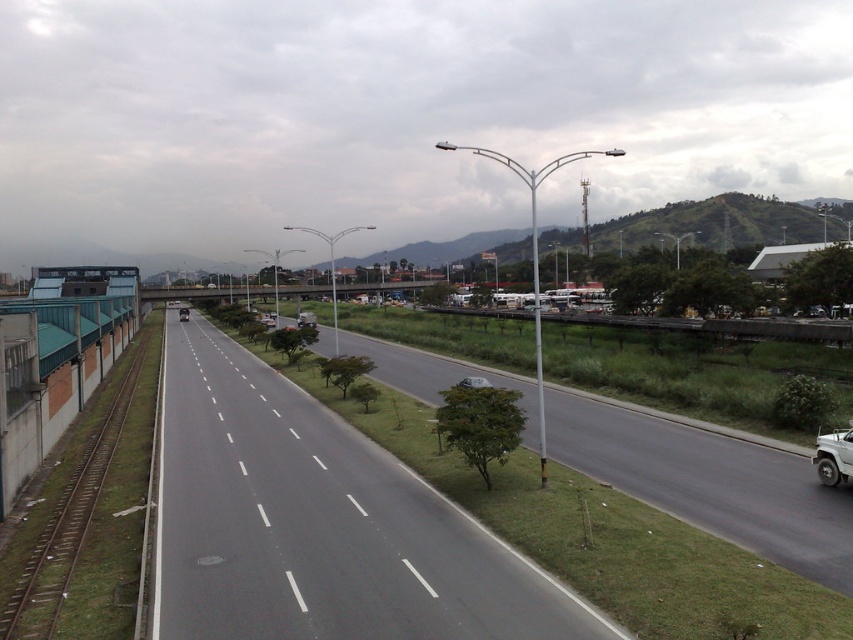
Question: Which object is positioned farthest from the brown metal train track at left?

Choices:
 (A) white matte truck at lower right
 (B) white glossy car at center
 (C) shiny black sedan at center

Answer: (C)

Question: Can you confirm if brown metal train track at left is smaller than shiny black sedan at center?

Choices:
 (A) yes
 (B) no

Answer: (A)

Question: Which point is closer to the camera?

Choices:
 (A) shiny black sedan at center
 (B) brown metal train track at left

Answer: (B)

Question: Which object is farther from the camera taking this photo?

Choices:
 (A) brown metal train track at left
 (B) shiny black sedan at center
 (C) asphalt road at center

Answer: (B)

Question: Is white glossy car at center above shiny black sedan at center?

Choices:
 (A) yes
 (B) no

Answer: (B)

Question: Is white matte truck at lower right wider than shiny black sedan at center?

Choices:
 (A) yes
 (B) no

Answer: (B)